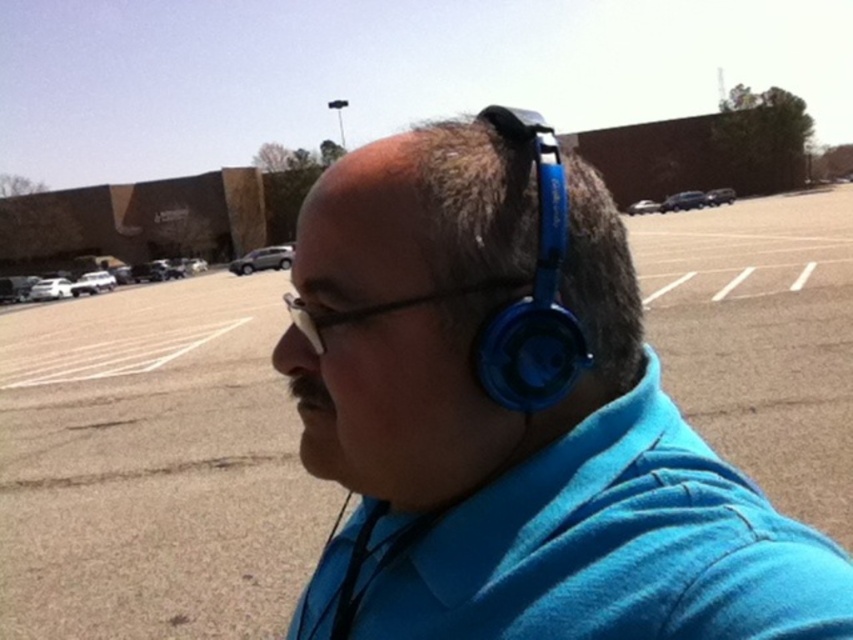
You are a photographer trying to capture both the blue matte headphones at center and the blue plastic headphones at upper right in a single frame. Given their sizes, which headphones will appear larger in your photo?

The blue matte headphones at center will appear larger in the photo because their width is larger than the blue plastic headphones at upper right.

You are a photographer trying to capture a candid shot of the person in the scene. The camera you are using has a focal length of 50mm. If you want to maintain the same framing but switch to a 35mm lens to include more background details, how much closer or farther should you move the camera relative to the person? Consider the point at coordinates point (782, 627) as the subject focus point.

To maintain the same framing with a 35mm lens, you need to move closer to the subject. Since the 35mm lens has a wider angle than the 50mm lens, decreasing the focal length allows you to capture more of the background while keeping the subject in focus at point (782, 627). The exact distance adjustment depends on the desired framing, but generally, moving approximately 15.20 inches closer would help achieve the desired effect based on the current camera distance of 15.20 inches from the focus point.